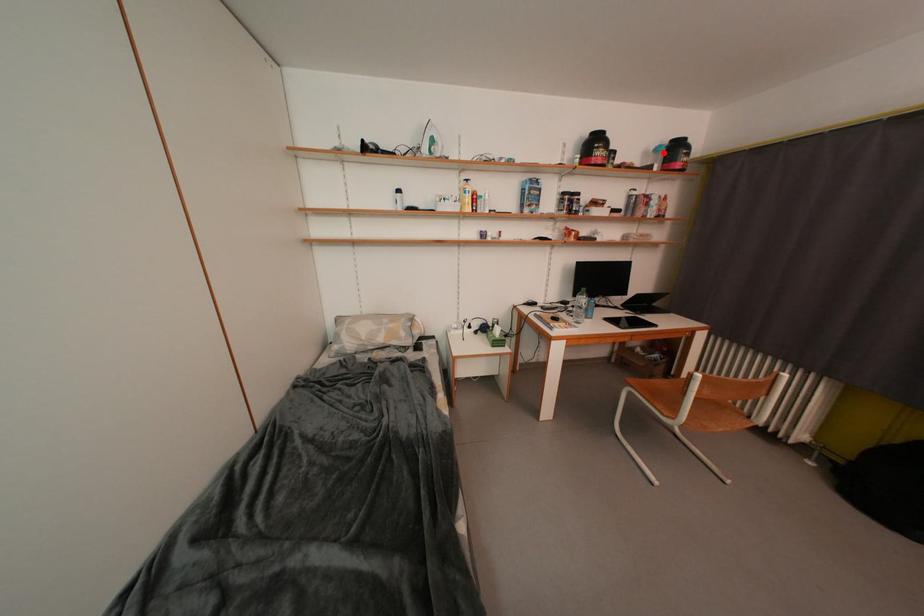
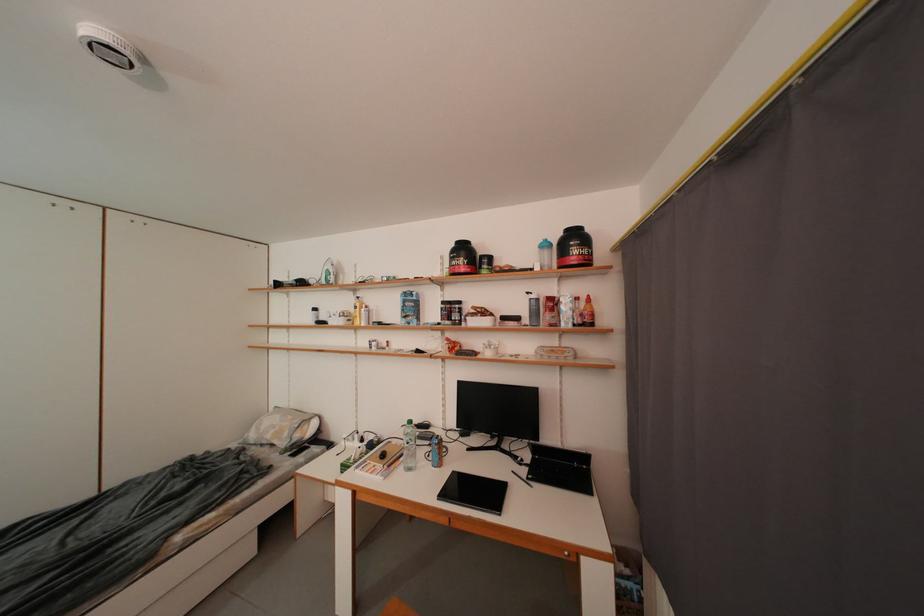
The point at the highlighted location is marked in the first image. Where is the corresponding point in the second image?

(553, 249)